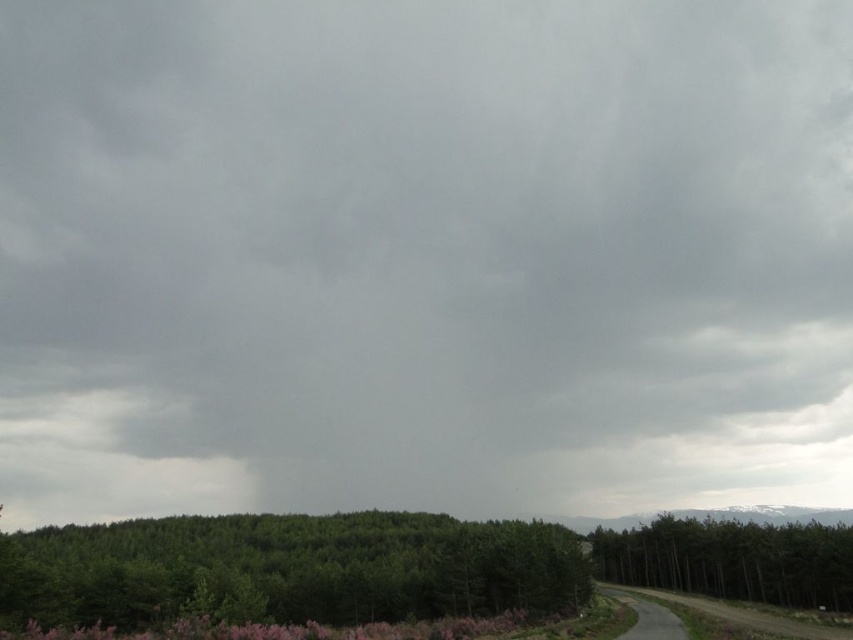
Can you confirm if green matte tree at lower center is smaller than green matte tree at right?

Incorrect, green matte tree at lower center is not smaller in size than green matte tree at right.

Can you confirm if green matte tree at lower center is positioned below green matte tree at right?

Incorrect, green matte tree at lower center is not positioned below green matte tree at right.

Does point (524, 604) come in front of point (642, 541)?

Yes, it is.

Locate an element on the screen. The width and height of the screenshot is (853, 640). green matte tree at lower center is located at coordinates (289, 570).